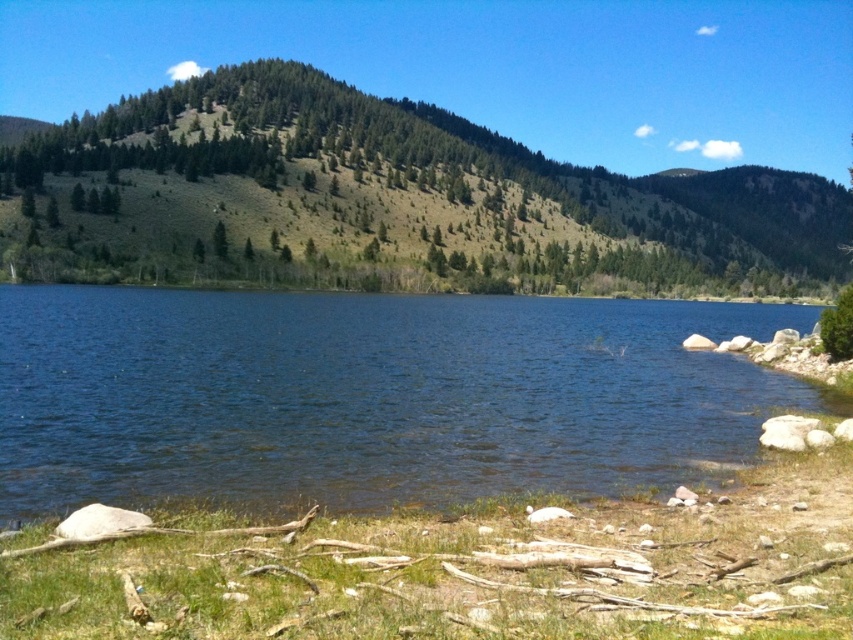
You are standing at the lakeshore and want to estimate the relative sizes of the blue water at center and the green textured hillside at center. Which one appears larger in the scene?

The green textured hillside at center appears larger than the blue water at center in the scene.

Looking at this image, you are standing on the lakeshore and want to take a photo of both the blue water at center and the green textured hillside at center. Which object should you focus on first to ensure both are in the frame?

You should focus on the blue water at center first since it is closer to you than the green textured hillside at center, so by focusing on the closer object, both will be in focus.